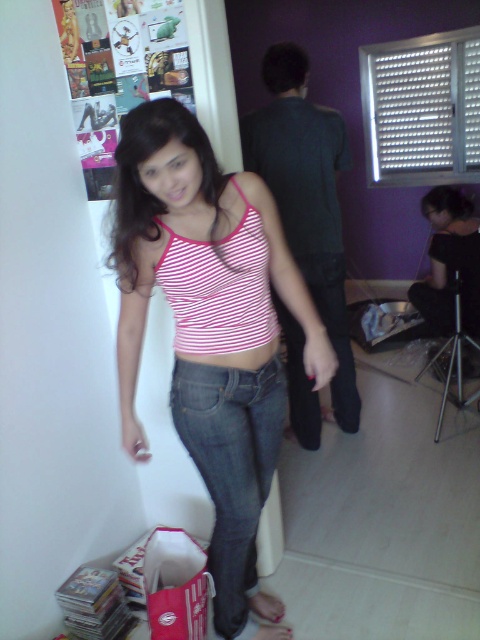
Measure the distance between point (178, 280) and camera.

Point (178, 280) and camera are 1.41 meters apart.

Who is taller, pink striped tank top at center or denim jeans at lower center?

With more height is pink striped tank top at center.

Does point (203, 333) come closer to viewer compared to point (231, 406)?

Yes, it is in front of point (231, 406).

This screenshot has width=480, height=640. I want to click on pink striped tank top at center, so click(x=211, y=332).

Where is `pink striped tank top at center`? pink striped tank top at center is located at coordinates point(211,332).

Where is `pink striped tank top at center`? pink striped tank top at center is located at coordinates (211, 332).

Is denim jeans at lower center above denim at center?

Actually, denim jeans at lower center is below denim at center.

Does point (180, 404) come closer to viewer compared to point (350, 364)?

Yes.

You are a GUI agent. You are given a task and a screenshot of the screen. Output one action in this format:
    pyautogui.click(x=<x>, y=<y>)
    Task: Click on the denim jeans at lower center
    Image resolution: width=480 pixels, height=640 pixels.
    Given the screenshot: What is the action you would take?
    pyautogui.click(x=231, y=467)